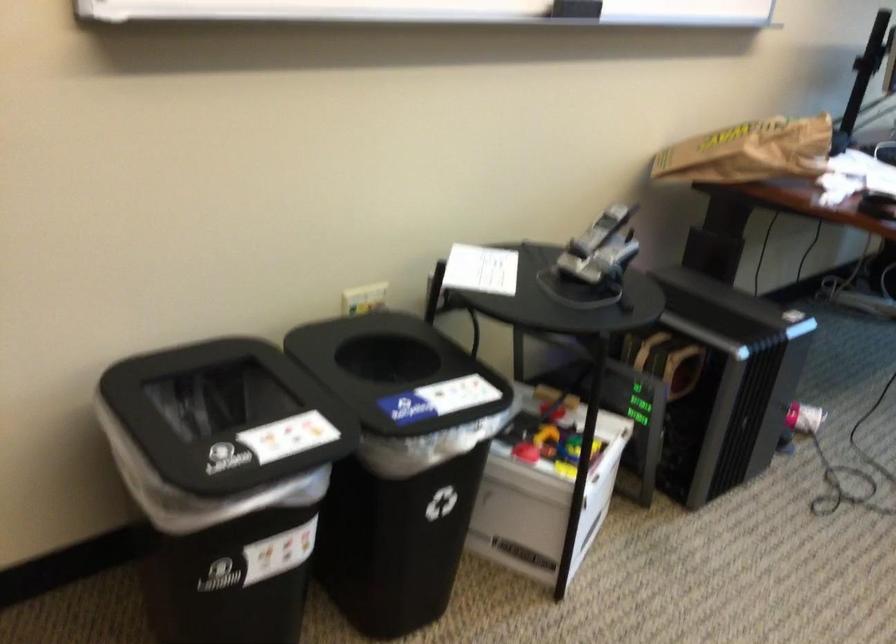
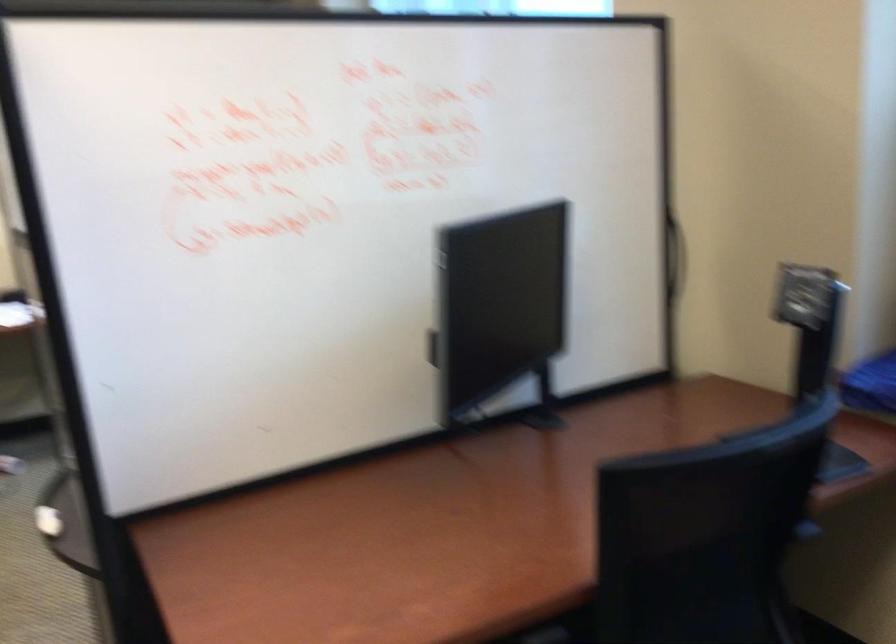
Question: What movement of the cameraman would produce the second image?

Choices:
 (A) Left
 (B) Right
 (C) Forward
 (D) Backward

Answer: (B)